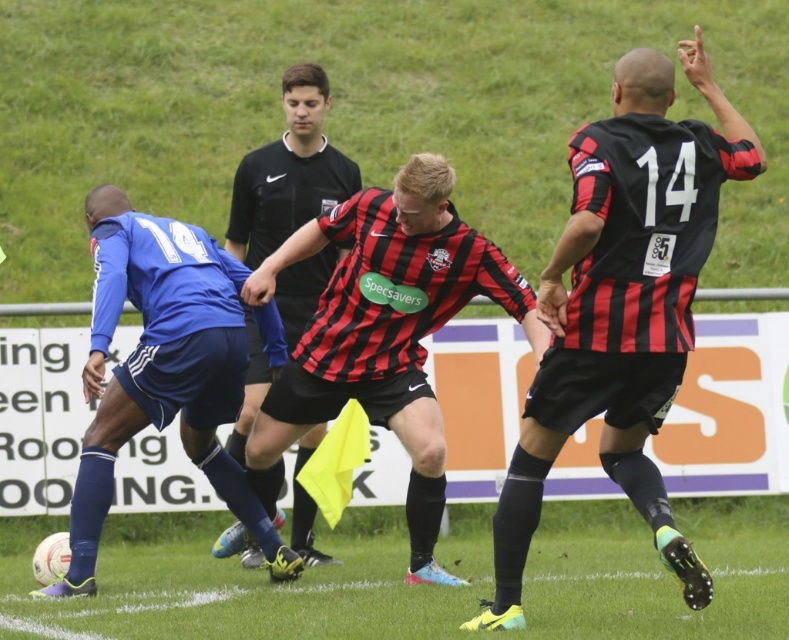
Can you confirm if black and red striped jersey at upper right is taller than red and black striped jersey at center?

Yes, black and red striped jersey at upper right is taller than red and black striped jersey at center.

Can you confirm if black and red striped jersey at upper right is shorter than red and black striped jersey at center?

No.

Does point (664, 60) lie in front of point (438, 321)?

Yes, point (664, 60) is closer to viewer.

Locate an element on the screen. black and red striped jersey at upper right is located at coordinates [x=623, y=305].

Based on the photo, which is more to the right, blue fabric jersey at left or black jersey at center?

From the viewer's perspective, black jersey at center appears more on the right side.

Looking at this image, can you confirm if blue fabric jersey at left is positioned to the right of black jersey at center?

No, blue fabric jersey at left is not to the right of black jersey at center.

Where is `blue fabric jersey at left`? blue fabric jersey at left is located at coordinates (163, 369).

Find the location of a particular element. blue fabric jersey at left is located at coordinates (163, 369).

How much distance is there between green grass at lower center and blue fabric jersey at left?

green grass at lower center is 1.86 meters from blue fabric jersey at left.

In the scene shown: Which of these two, green grass at lower center or blue fabric jersey at left, stands taller?

blue fabric jersey at left

Identify the location of green grass at lower center. The height and width of the screenshot is (640, 789). (251, 582).